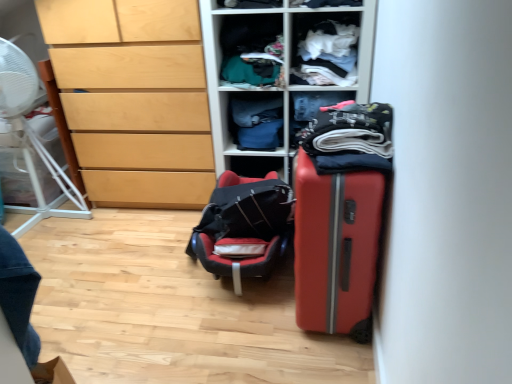
This screenshot has width=512, height=384. Find the location of `vacant space situated on the left part of black fabric backpack at center`. vacant space situated on the left part of black fabric backpack at center is located at coordinates (130, 264).